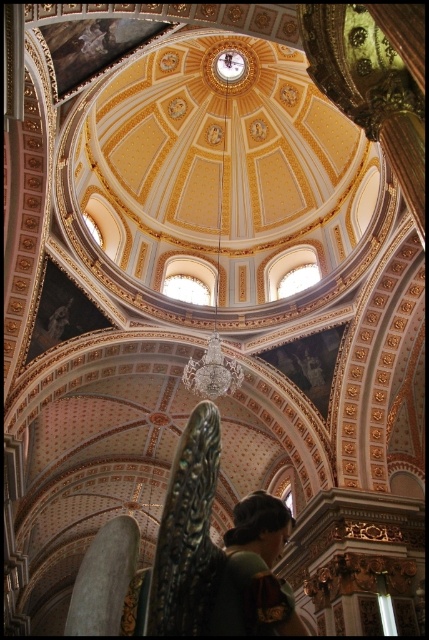
Question: Is green fabric headscarf at lower center above gold metallic chandelier at center?

Choices:
 (A) no
 (B) yes

Answer: (A)

Question: Is green fabric headscarf at lower center to the right of gold metallic chandelier at center from the viewer's perspective?

Choices:
 (A) no
 (B) yes

Answer: (B)

Question: Is green fabric headscarf at lower center further to the viewer compared to gold metallic chandelier at center?

Choices:
 (A) yes
 (B) no

Answer: (B)

Question: Which point is farther to the camera?

Choices:
 (A) (236, 534)
 (B) (241, 72)

Answer: (B)